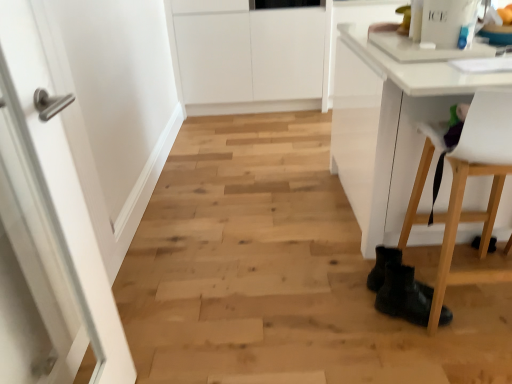
Question: Visually, is white glossy door at left positioned to the left or to the right of black leather boots at lower right?

Choices:
 (A) left
 (B) right

Answer: (A)

Question: Looking at their shapes, would you say white glossy door at left is wider or thinner than black leather boots at lower right?

Choices:
 (A) thin
 (B) wide

Answer: (A)

Question: Estimate the real-world distances between objects in this image. Which object is farther from the black leather boots at lower right?

Choices:
 (A) white glossy door at left
 (B) white plastic chair at lower right

Answer: (A)

Question: Which object is positioned closest to the black leather boots at lower right?

Choices:
 (A) white glossy door at left
 (B) white plastic chair at lower right

Answer: (B)